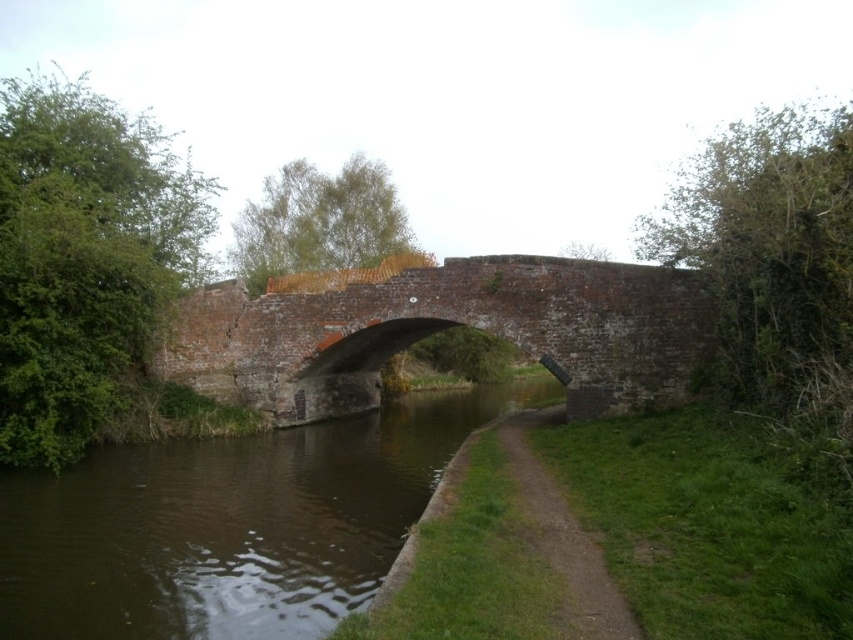
Is brown brick bridge at center above dirt/gravel path at center?

Correct, brown brick bridge at center is located above dirt/gravel path at center.

Is brown brick bridge at center to the left of dirt/gravel path at center from the viewer's perspective?

Yes, brown brick bridge at center is to the left of dirt/gravel path at center.

What do you see at coordinates (440, 330) in the screenshot? I see `brown brick bridge at center` at bounding box center [440, 330].

The width and height of the screenshot is (853, 640). What are the coordinates of `brown brick bridge at center` in the screenshot? It's located at (440, 330).

Between point (163, 636) and point (577, 554), which one is positioned in front?

Positioned in front is point (163, 636).

Is brown smooth water at center shorter than dirt/gravel path at center?

Incorrect, brown smooth water at center's height does not fall short of dirt/gravel path at center's.

Is point (155, 490) positioned in front of point (589, 545)?

No, (155, 490) is behind (589, 545).

Locate an element on the screen. The width and height of the screenshot is (853, 640). brown smooth water at center is located at coordinates (230, 524).

Is brown smooth water at center wider than brown brick bridge at center?

No, brown smooth water at center is not wider than brown brick bridge at center.

Who is more distant from viewer, (498, 388) or (695, 360)?

The point (498, 388) is behind.

Identify the location of brown smooth water at center. This screenshot has width=853, height=640. (230, 524).